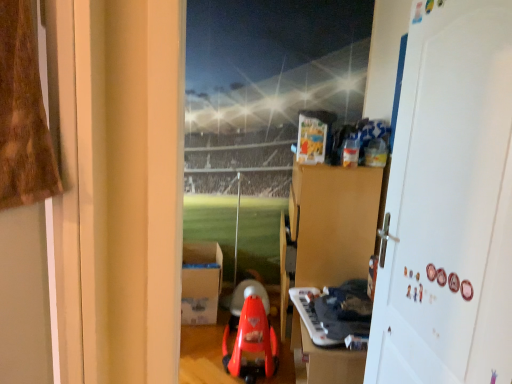
Question: Can you confirm if white cardboard box at center is taller than brown cardboard dresser at upper center?

Choices:
 (A) yes
 (B) no

Answer: (B)

Question: Can you confirm if white cardboard box at center is positioned to the left of brown cardboard dresser at upper center?

Choices:
 (A) no
 (B) yes

Answer: (B)

Question: Does white cardboard box at center lie behind brown cardboard dresser at upper center?

Choices:
 (A) no
 (B) yes

Answer: (B)

Question: Considering the relative positions of white cardboard box at center and brown cardboard dresser at upper center in the image provided, is white cardboard box at center to the right of brown cardboard dresser at upper center from the viewer's perspective?

Choices:
 (A) yes
 (B) no

Answer: (B)

Question: Could brown cardboard dresser at upper center be considered to be inside white cardboard box at center?

Choices:
 (A) no
 (B) yes

Answer: (A)

Question: In the image, is rubberized red walker at center, acting as the 2th toy starting from the right, positioned in front of or behind white matte door at right?

Choices:
 (A) front
 (B) behind

Answer: (B)

Question: Considering the positions of rubberized red walker at center, the first toy when ordered from left to right, and white matte door at right in the image, is rubberized red walker at center, the first toy when ordered from left to right, wider or thinner than white matte door at right?

Choices:
 (A) thin
 (B) wide

Answer: (B)

Question: From the image's perspective, is rubberized red walker at center, the first toy when ordered from left to right, located above or below white matte door at right?

Choices:
 (A) above
 (B) below

Answer: (B)

Question: Based on their sizes in the image, would you say rubberized red walker at center, the first toy when ordered from left to right, is bigger or smaller than white matte door at right?

Choices:
 (A) small
 (B) big

Answer: (B)

Question: Considering the positions of white cardboard box at center and white plastic keyboard at lower center, which is the first toy from right to left, in the image, is white cardboard box at center wider or thinner than white plastic keyboard at lower center, which is the first toy from right to left,?

Choices:
 (A) thin
 (B) wide

Answer: (B)

Question: From their relative heights in the image, would you say white cardboard box at center is taller or shorter than white plastic keyboard at lower center, which is the first toy from right to left?

Choices:
 (A) short
 (B) tall

Answer: (B)

Question: From a real-world perspective, is white cardboard box at center above or below white plastic keyboard at lower center, the second toy when ordered from left to right?

Choices:
 (A) above
 (B) below

Answer: (B)

Question: Is point (211, 292) positioned closer to the camera than point (294, 288)?

Choices:
 (A) farther
 (B) closer

Answer: (A)

Question: Is white matte door at right in front of or behind white plastic keyboard at lower center, the second toy when ordered from left to right, in the image?

Choices:
 (A) behind
 (B) front

Answer: (B)

Question: Based on their sizes in the image, would you say white matte door at right is bigger or smaller than white plastic keyboard at lower center, the second toy when ordered from left to right?

Choices:
 (A) small
 (B) big

Answer: (B)